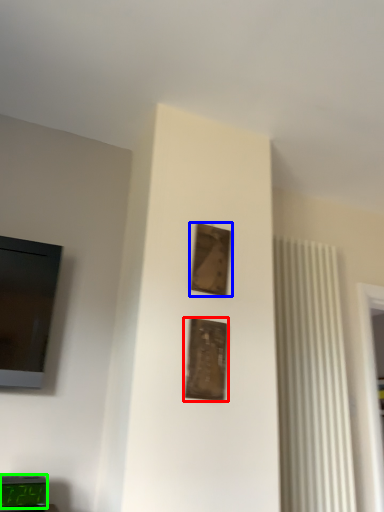
Question: Which is nearer to the picture frame (highlighted by a red box)? picture frame (highlighted by a blue box) or alarm clock (highlighted by a green box).

Choices:
 (A) picture frame
 (B) alarm clock

Answer: (A)